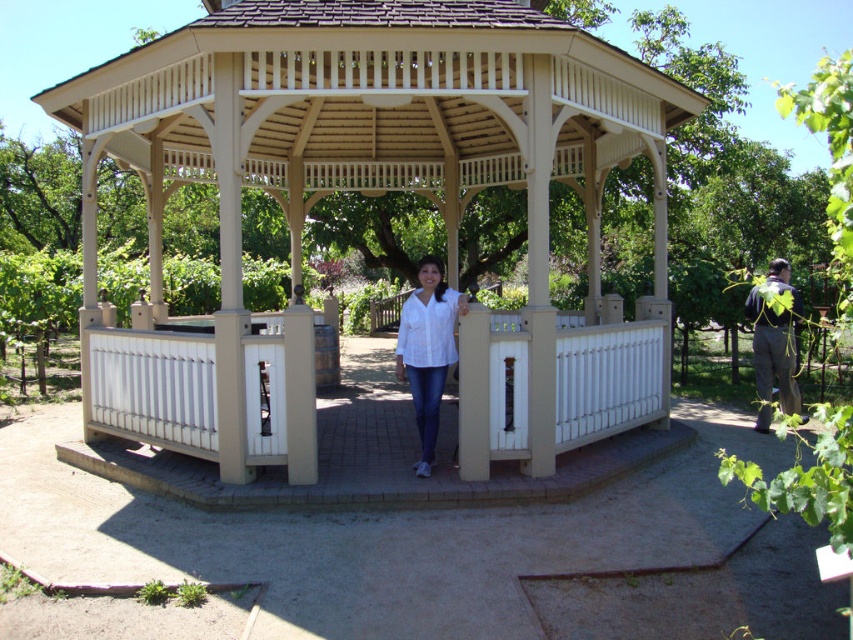
Question: Does beige wood gazebo at center lie in front of white matte shirt at center?

Choices:
 (A) yes
 (B) no

Answer: (A)

Question: Which object is the farthest from the white matte shirt at center?

Choices:
 (A) beige wood gazebo at center
 (B) gray fabric jacket at lower right

Answer: (B)

Question: Is beige wood gazebo at center above white matte shirt at center?

Choices:
 (A) no
 (B) yes

Answer: (A)

Question: Is white matte shirt at center positioned at the back of gray fabric jacket at lower right?

Choices:
 (A) no
 (B) yes

Answer: (A)

Question: Among these points, which one is nearest to the camera?

Choices:
 (A) (560, 20)
 (B) (422, 376)

Answer: (B)

Question: Which of the following is the closest to the observer?

Choices:
 (A) gray fabric jacket at lower right
 (B) beige wood gazebo at center
 (C) white matte shirt at center

Answer: (B)